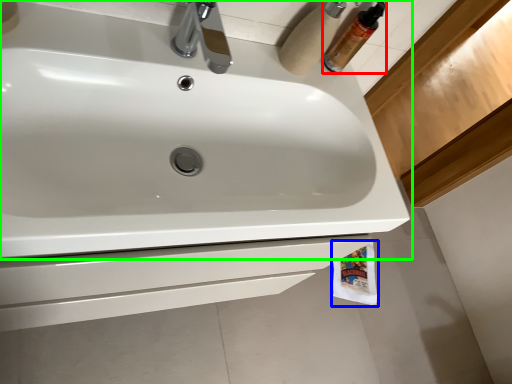
Question: Considering the real-world distances, which object is farthest from mouthwash (highlighted by a red box)? toilet paper (highlighted by a blue box) or sink (highlighted by a green box)?

Choices:
 (A) toilet paper
 (B) sink

Answer: (A)